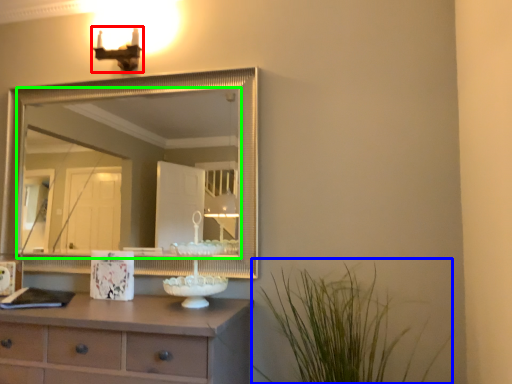
Question: Considering the real-world distances, which object is farthest from light fixture (highlighted by a red box)? plant (highlighted by a blue box) or mirror (highlighted by a green box)?

Choices:
 (A) plant
 (B) mirror

Answer: (B)